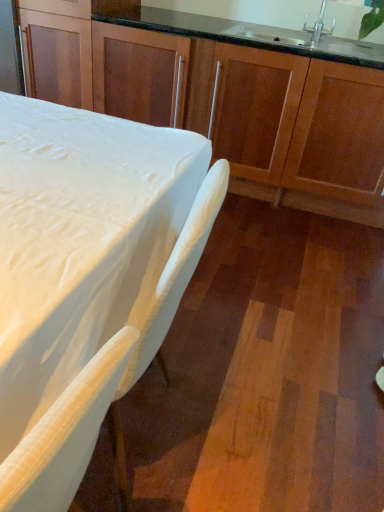
Describe the element at coordinates (232, 100) in the screenshot. The image size is (384, 512). I see `wooden cabinets at center` at that location.

Identify the location of wooden cabinets at center. (232, 100).

From the image's perspective, which one is positioned lower, white matte table at lower left or silver metallic faucet at upper right?

white matte table at lower left appears lower in the image.

Does white matte table at lower left lie behind silver metallic faucet at upper right?

That is False.

Visually, is white matte table at lower left positioned to the left or to the right of silver metallic faucet at upper right?

Clearly, white matte table at lower left is on the left of silver metallic faucet at upper right in the image.

Identify the location of faucet that appears behind the wooden cabinets at center. The width and height of the screenshot is (384, 512). (318, 26).

Consider the image. Is silver metallic faucet at upper right wider or thinner than wooden cabinets at center?

In the image, silver metallic faucet at upper right appears to be more narrow than wooden cabinets at center.

Is silver metallic faucet at upper right positioned far away from wooden cabinets at center?

No, silver metallic faucet at upper right is in close proximity to wooden cabinets at center.

Is silver metallic faucet at upper right facing away from white matte table at lower left?

No, white matte table at lower left is not at the back of silver metallic faucet at upper right.

Which of these two, silver metallic faucet at upper right or white matte table at lower left, stands shorter?

Standing shorter between the two is silver metallic faucet at upper right.

At what (x,y) coordinates should I click in order to perform the action: click on table below the silver metallic faucet at upper right (from the image's perspective). Please return your answer as a coordinate pair (x, y). The width and height of the screenshot is (384, 512). Looking at the image, I should click on (77, 276).

From a real-world perspective, is wooden cabinets at center over white matte table at lower left?

Yes, from a real-world perspective, wooden cabinets at center is over white matte table at lower left

Which object is more forward, wooden cabinets at center or white matte table at lower left?

white matte table at lower left is more forward.

From the image's perspective, between wooden cabinets at center and white matte table at lower left, who is located below?

From the image's view, white matte table at lower left is below.

Is wooden cabinets at center to the right of white matte table at lower left from the viewer's perspective?

Indeed, wooden cabinets at center is positioned on the right side of white matte table at lower left.

Can you confirm if white matte table at lower left is smaller than wooden cabinets at center?

Correct, white matte table at lower left occupies less space than wooden cabinets at center.

From the image's perspective, is white matte table at lower left beneath wooden cabinets at center?

Correct, white matte table at lower left appears lower than wooden cabinets at center in the image.

Is the position of white matte table at lower left more distant than that of wooden cabinets at center?

No, white matte table at lower left is closer to the viewer.

Are white matte table at lower left and wooden cabinets at center beside each other?

No, white matte table at lower left is not beside wooden cabinets at center.

Which is behind, point (355, 148) or point (321, 7)?

Positioned behind is point (321, 7).

Considering the relative positions of wooden cabinets at center and silver metallic faucet at upper right in the image provided, is wooden cabinets at center to the right of silver metallic faucet at upper right from the viewer's perspective?

Incorrect, wooden cabinets at center is not on the right side of silver metallic faucet at upper right.

Which of these two, wooden cabinets at center or silver metallic faucet at upper right, is wider?

wooden cabinets at center.

Locate an element on the screen. table located in front of the silver metallic faucet at upper right is located at coordinates (77, 276).

This screenshot has height=512, width=384. I want to click on faucet that is behind the wooden cabinets at center, so click(318, 26).

Consider the image. Which object lies further to the anchor point silver metallic faucet at upper right, white matte table at lower left or wooden cabinets at center?

Based on the image, white matte table at lower left appears to be further to silver metallic faucet at upper right.

From the image, which object appears to be nearer to white matte table at lower left, wooden cabinets at center or silver metallic faucet at upper right?

wooden cabinets at center is positioned closer to the anchor white matte table at lower left.

When comparing their distances from wooden cabinets at center, does white matte table at lower left or silver metallic faucet at upper right seem further?

white matte table at lower left lies further to wooden cabinets at center than the other object.

Considering their positions, is silver metallic faucet at upper right positioned further to wooden cabinets at center than white matte table at lower left?

Based on the image, white matte table at lower left appears to be further to wooden cabinets at center.

Looking at the image, which one is located closer to white matte table at lower left, silver metallic faucet at upper right or wooden cabinets at center?

Based on the image, wooden cabinets at center appears to be nearer to white matte table at lower left.

Looking at the image, which one is located further to silver metallic faucet at upper right, wooden cabinets at center or white matte table at lower left?

Based on the image, white matte table at lower left appears to be further to silver metallic faucet at upper right.

The width and height of the screenshot is (384, 512). Find the location of `cabinetry between silver metallic faucet at upper right and white matte table at lower left from top to bottom`. cabinetry between silver metallic faucet at upper right and white matte table at lower left from top to bottom is located at coordinates (232, 100).